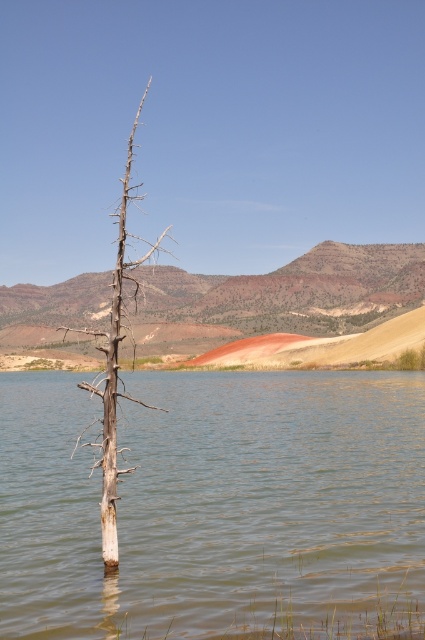
Question: Can you confirm if brown matte water at center is smaller than dead wood tree at center?

Choices:
 (A) yes
 (B) no

Answer: (A)

Question: Does brown matte water at center appear on the left side of dead wood tree at center?

Choices:
 (A) no
 (B) yes

Answer: (A)

Question: From the image, what is the correct spatial relationship of brown matte water at center in relation to dead wood tree at center?

Choices:
 (A) above
 (B) below

Answer: (B)

Question: Which of the following is the farthest from the observer?

Choices:
 (A) (377, 467)
 (B) (102, 548)

Answer: (A)